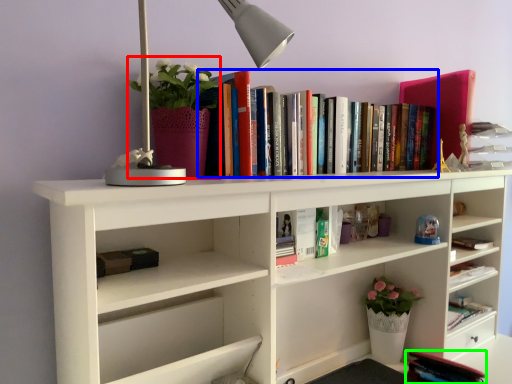
Question: Which object is positioned closest to floral arrangement (highlighted by a red box)? Select from book (highlighted by a blue box) and book (highlighted by a green box).

Choices:
 (A) book
 (B) book

Answer: (A)